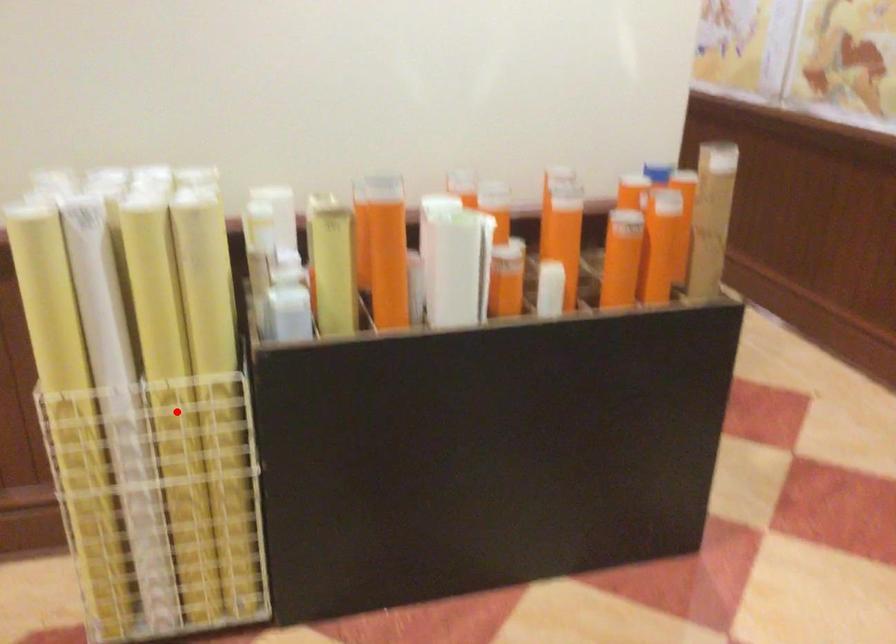
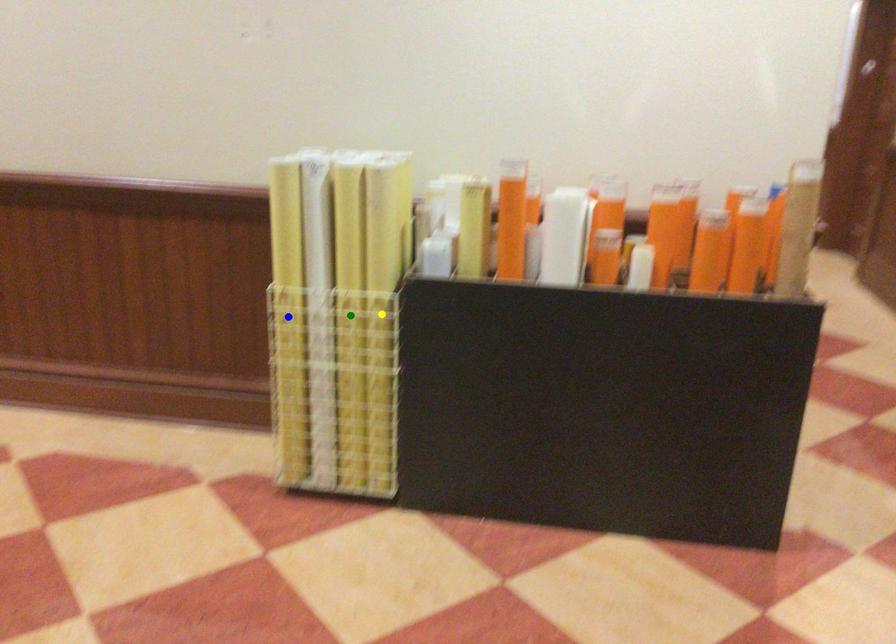
Question: I am providing you with two images of the same scene from different viewpoints. A red point is marked on the first image. You are given multiple points on the second image. Can you choose the point in image 2 that corresponds to the point in image 1?

Choices:
 (A) blue point
 (B) green point
 (C) yellow point

Answer: (B)